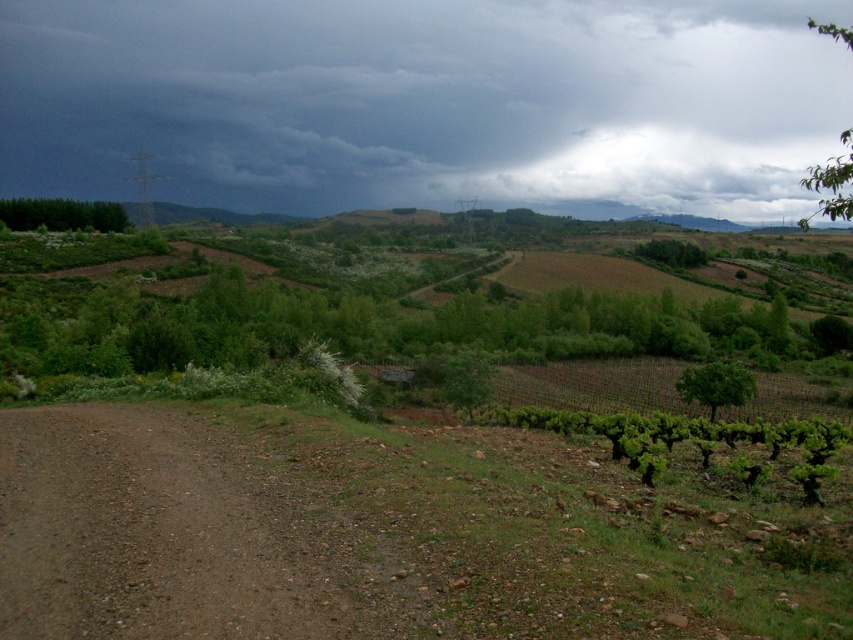
You are standing at the center of the dirt road in the rural landscape. You want to locate the dark gray cloud at upper center. In which direction should you look?

You should look upward towards the center of the sky to find the dark gray cloud at upper center, as it is positioned at point coordinates of 0.159 on the x axis and 0.497 on the y axis.

You are a hiker planning to take a photo of the dark gray cloud at upper center and the green leafy trees at left. Which object should you focus on first to ensure both are in frame?

You should focus on the green leafy trees at left first because the dark gray cloud at upper center is above them, so adjusting the camera angle to include the cloud above will naturally keep the trees in view.

You are a hiker standing on the dirt road in the foreground of the rural landscape. You see the dark gray cloud at upper center and the green leafy trees at left. Which object is positioned to the right of the other?

The dark gray cloud at upper center is to the right of the green leafy trees at left.